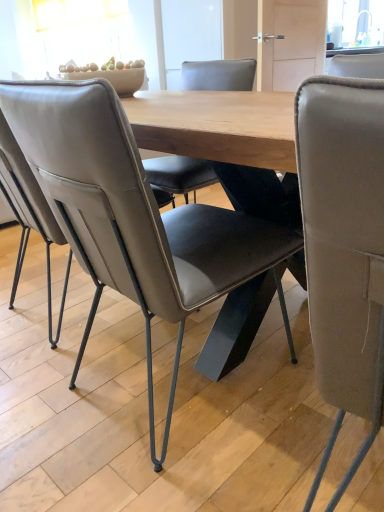
Question: Should I look upward or downward to see leather at right, acting as the first chair starting from the right?

Choices:
 (A) up
 (B) down

Answer: (B)

Question: Should I look upward or downward to see leather at center, positioned as the 1th chair in left-to-right order?

Choices:
 (A) up
 (B) down

Answer: (A)

Question: Is leather at right, acting as the first chair starting from the right, at the back of leather at center, positioned as the 1th chair in left-to-right order?

Choices:
 (A) yes
 (B) no

Answer: (B)

Question: From a real-world perspective, is leather at center, arranged as the second chair when viewed from the right, under leather at right, the 2th chair when ordered from left to right?

Choices:
 (A) no
 (B) yes

Answer: (A)

Question: Can you confirm if leather at center, arranged as the second chair when viewed from the right, is thinner than leather at right, acting as the first chair starting from the right?

Choices:
 (A) no
 (B) yes

Answer: (B)

Question: Does leather at center, arranged as the second chair when viewed from the right, appear on the left side of leather at right, the 2th chair when ordered from left to right?

Choices:
 (A) yes
 (B) no

Answer: (A)

Question: Are leather at center, positioned as the 1th chair in left-to-right order, and leather at right, the 2th chair when ordered from left to right, making contact?

Choices:
 (A) no
 (B) yes

Answer: (A)

Question: Can you confirm if leather at center, positioned as the 1th chair in left-to-right order, is taller than leather at right, the 2th chair when ordered from left to right?

Choices:
 (A) yes
 (B) no

Answer: (B)

Question: Can you confirm if leather at right, acting as the first chair starting from the right, is shorter than leather at center, arranged as the second chair when viewed from the right?

Choices:
 (A) no
 (B) yes

Answer: (A)

Question: Is leather at right, acting as the first chair starting from the right, facing towards leather at center, arranged as the second chair when viewed from the right?

Choices:
 (A) yes
 (B) no

Answer: (B)

Question: Is leather at right, the 2th chair when ordered from left to right, thinner than leather at center, arranged as the second chair when viewed from the right?

Choices:
 (A) no
 (B) yes

Answer: (A)

Question: From the image's perspective, is leather at right, the 2th chair when ordered from left to right, on leather at center, arranged as the second chair when viewed from the right?

Choices:
 (A) no
 (B) yes

Answer: (A)

Question: Is leather at right, acting as the first chair starting from the right, smaller than leather at center, arranged as the second chair when viewed from the right?

Choices:
 (A) yes
 (B) no

Answer: (A)

Question: Does leather at right, acting as the first chair starting from the right, appear on the right side of leather at center, arranged as the second chair when viewed from the right?

Choices:
 (A) yes
 (B) no

Answer: (A)

Question: From the image's perspective, is leather at center, positioned as the 1th chair in left-to-right order, positioned above or below leather at right, acting as the first chair starting from the right?

Choices:
 (A) above
 (B) below

Answer: (A)